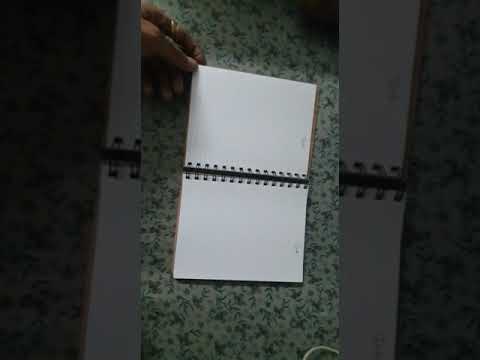
At what (x,y) coordinates should I click in order to perform the action: click on blank left side of notebook. Please return your answer as a coordinate pair (x, y). The image size is (480, 360). Looking at the image, I should click on (248, 109).